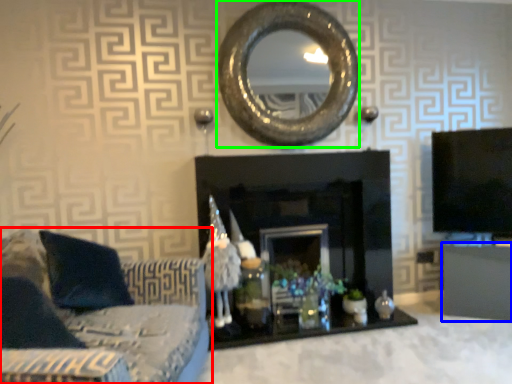
Question: Based on their relative distances, which object is farther from studio couch (highlighted by a red box)? Choose from furniture (highlighted by a blue box) and oval (highlighted by a green box).

Choices:
 (A) furniture
 (B) oval

Answer: (A)